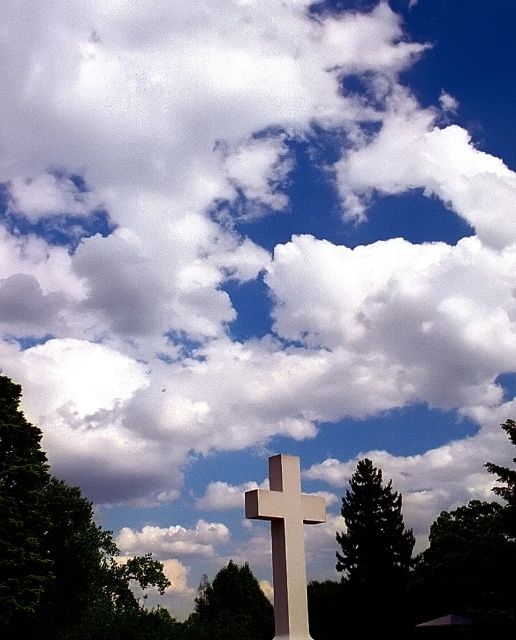
You are an artist sketching this scene and want to ensure the proportions between the green leafy tree at upper left and the white smooth cross at center are accurate. Which object is wider?

The green leafy tree at upper left is wider than the white smooth cross at center according to the description.

You are standing in front of the white cross and looking towards the partly cloudy sky. Where is the green leafy tree at upper left located in relation to the cross?

The green leafy tree at upper left is located at point [57,547] in the image, which is in the upper left area relative to the cross.